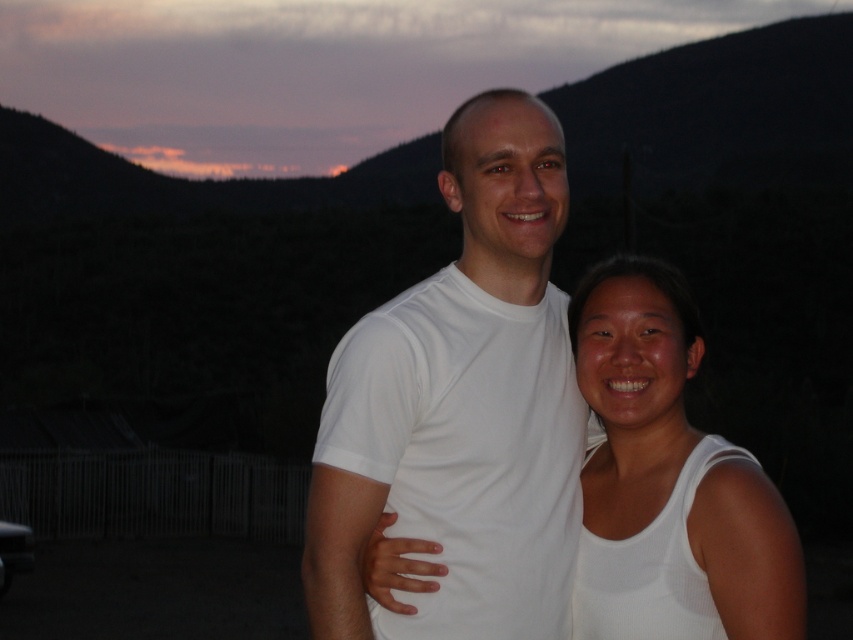
Question: Does white matte t-shirt at center have a larger size compared to white matte tank top at center?

Choices:
 (A) yes
 (B) no

Answer: (A)

Question: Which of the following is the farthest from the observer?

Choices:
 (A) white matte t-shirt at center
 (B) white matte tank top at center

Answer: (A)

Question: Which point is farther from the camera taking this photo?

Choices:
 (A) (355, 401)
 (B) (763, 620)

Answer: (A)

Question: Does white matte t-shirt at center appear under white matte tank top at center?

Choices:
 (A) yes
 (B) no

Answer: (B)

Question: Among these points, which one is farthest from the camera?

Choices:
 (A) (616, 618)
 (B) (556, 580)

Answer: (B)

Question: Is white matte t-shirt at center below white matte tank top at center?

Choices:
 (A) yes
 (B) no

Answer: (B)